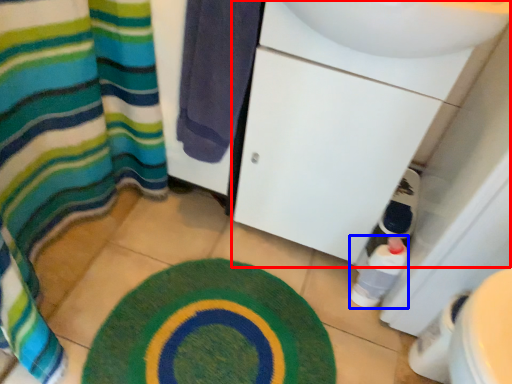
Question: Which object is closer to the camera taking this photo, sink (highlighted by a red box) or bottle (highlighted by a blue box)?

Choices:
 (A) sink
 (B) bottle

Answer: (A)